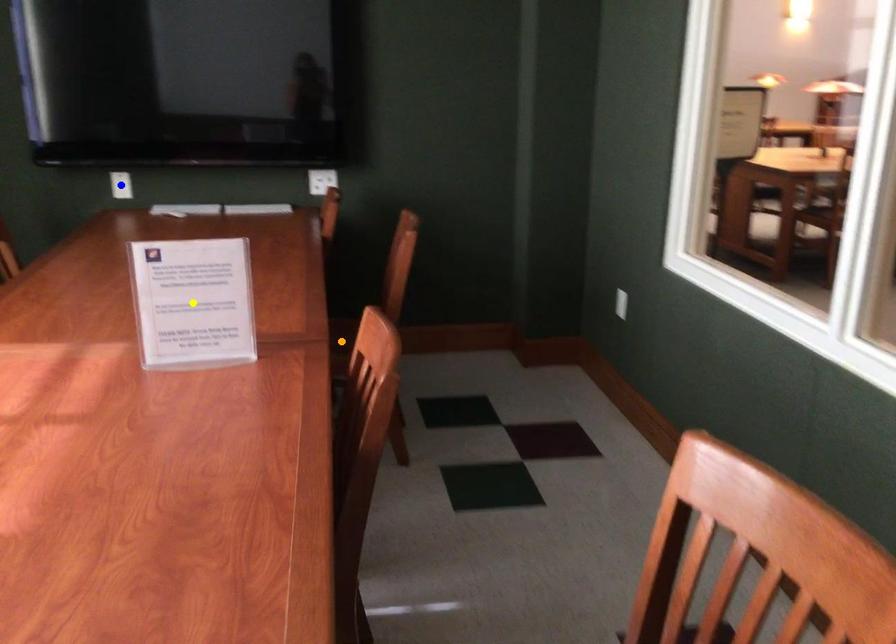
Order these from nearest to farthest:
blue point
orange point
yellow point

yellow point
orange point
blue point